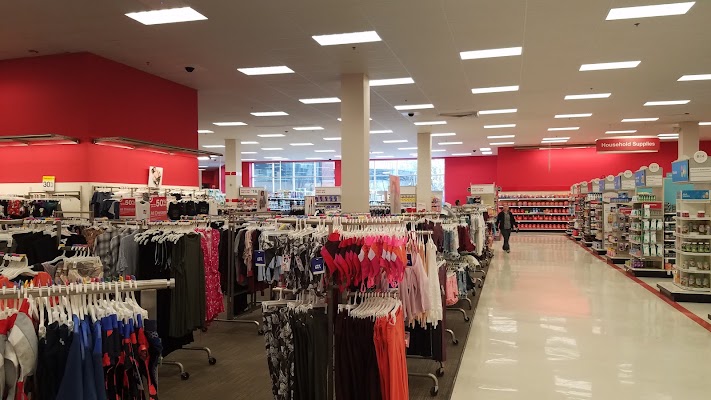
I want to click on gray carpet, so click(x=232, y=369).